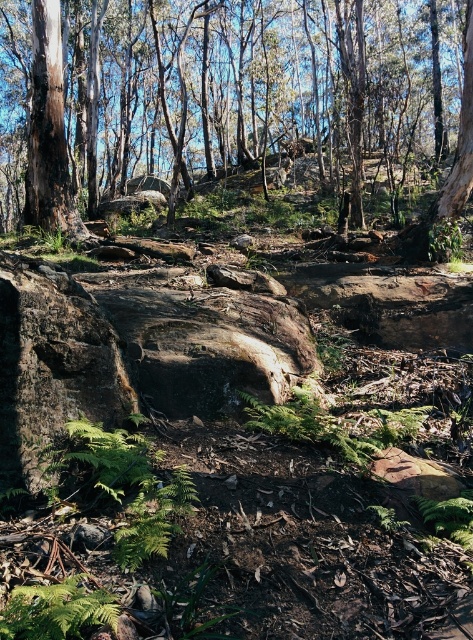
Question: Estimate the real-world distances between objects in this image. Which object is closer to the green matte fern at center?

Choices:
 (A) brown rough tree at center
 (B) green leafy fern at lower left

Answer: (B)

Question: Which object is farther from the camera taking this photo?

Choices:
 (A) green leafy fern at lower left
 (B) brown rough tree at center

Answer: (B)

Question: Which point is closer to the camera taking this photo?

Choices:
 (A) (78, 582)
 (B) (24, 3)
 (C) (387, 438)

Answer: (A)

Question: Does brown rough tree at center appear under green leafy fern at lower left?

Choices:
 (A) no
 (B) yes

Answer: (A)

Question: In this image, where is brown rough tree at center located relative to green matte fern at center?

Choices:
 (A) above
 (B) below

Answer: (A)

Question: Can you confirm if brown rough tree at center is wider than green matte fern at center?

Choices:
 (A) no
 (B) yes

Answer: (B)